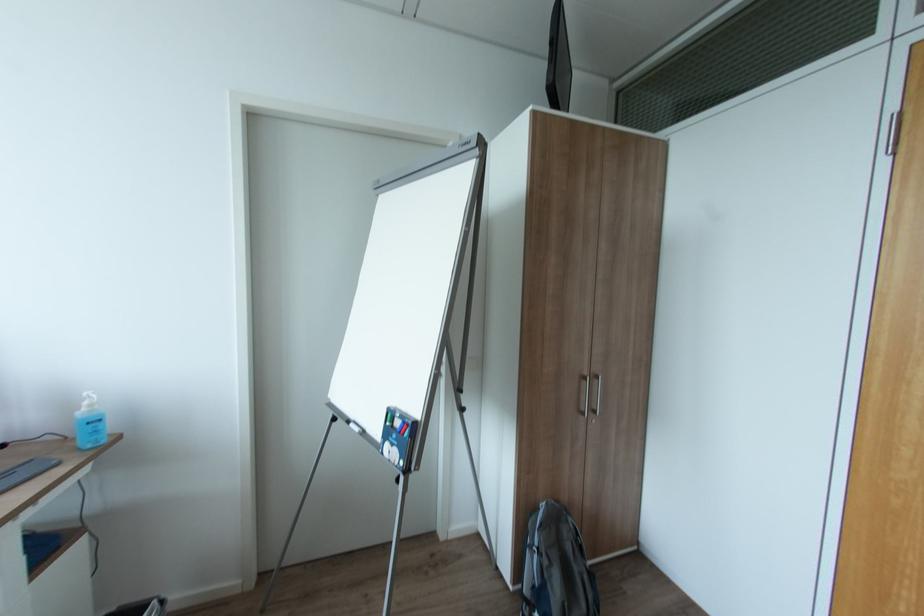
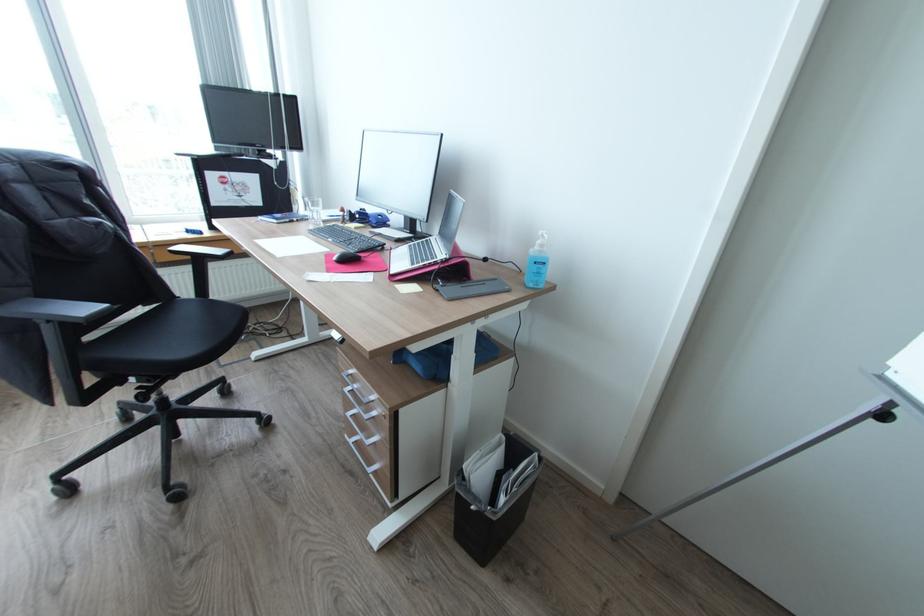
In the second image, find the point that corresponds to [93,447] in the first image.

(536, 284)